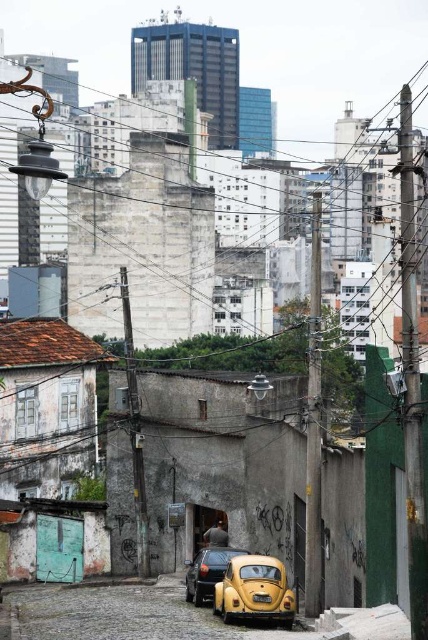
Question: Can you confirm if yellow matte car at center is positioned below yellow matte license plate at center?

Choices:
 (A) no
 (B) yes

Answer: (B)

Question: Among these objects, which one is farthest from the camera?

Choices:
 (A) yellow matte car at lower center
 (B) yellow matte license plate at center

Answer: (B)

Question: Is yellow matte car at center thinner than yellow matte license plate at center?

Choices:
 (A) yes
 (B) no

Answer: (B)

Question: Does yellow matte car at lower center have a smaller size compared to yellow matte license plate at center?

Choices:
 (A) no
 (B) yes

Answer: (A)

Question: Which is farther from the yellow matte car at center?

Choices:
 (A) yellow matte car at lower center
 (B) yellow matte license plate at center

Answer: (B)

Question: Among these objects, which one is farthest from the camera?

Choices:
 (A) yellow matte license plate at center
 (B) yellow matte car at center

Answer: (B)